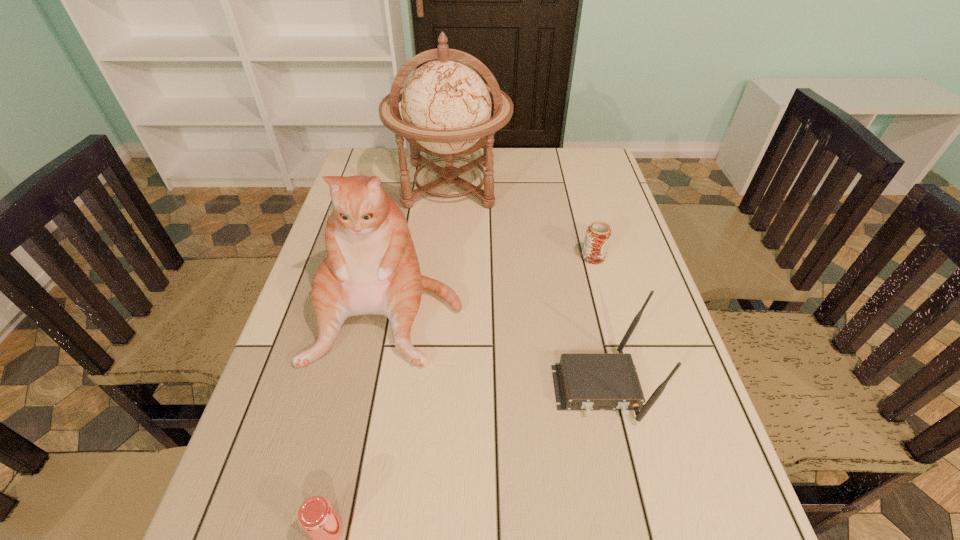
The width and height of the screenshot is (960, 540). In order to click on the farthest object in this screenshot , I will do `click(446, 106)`.

At what (x,y) coordinates should I click in order to perform the action: click on globe. Please return your answer as a coordinate pair (x, y). This screenshot has height=540, width=960. Looking at the image, I should click on (446, 106).

Find the location of `cat`. cat is located at coordinates (371, 267).

Locate an element on the screen. The width and height of the screenshot is (960, 540). the third shortest object is located at coordinates (583, 381).

The height and width of the screenshot is (540, 960). Identify the location of the right beer can. (598, 234).

Locate an element on the screen. The image size is (960, 540). vacant position located 0.110m on the front-facing side of the farthest object is located at coordinates (445, 245).

This screenshot has height=540, width=960. I want to click on vacant space located 0.180m on the face of the cat, so click(361, 453).

Find the location of a particular element. The image size is (960, 540). free space located 0.140m on the back of the router to connect cables is located at coordinates (622, 503).

Where is `free region located on the left of the right beer can`? This screenshot has width=960, height=540. free region located on the left of the right beer can is located at coordinates (512, 257).

This screenshot has height=540, width=960. What are the coordinates of `object at the far edge` in the screenshot? It's located at (446, 106).